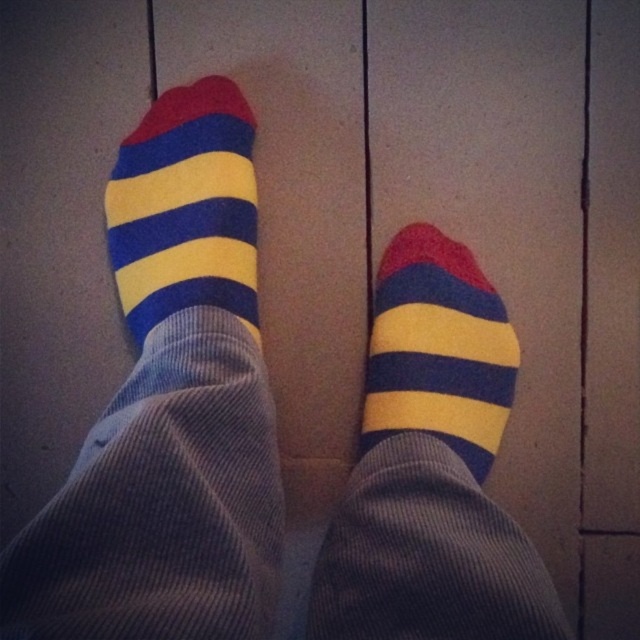
Question: Does yellow-blue striped sock at center appear over matte striped sock at center?

Choices:
 (A) yes
 (B) no

Answer: (A)

Question: Which object appears farthest from the camera in this image?

Choices:
 (A) matte striped sock at center
 (B) yellow-blue striped sock at center

Answer: (B)

Question: Among these objects, which one is farthest from the camera?

Choices:
 (A) matte striped sock at center
 (B) yellow-blue striped sock at center

Answer: (B)

Question: Does yellow-blue striped sock at center appear on the right side of matte striped sock at center?

Choices:
 (A) yes
 (B) no

Answer: (B)

Question: Can you confirm if yellow-blue striped sock at center is positioned to the left of matte striped sock at center?

Choices:
 (A) yes
 (B) no

Answer: (A)